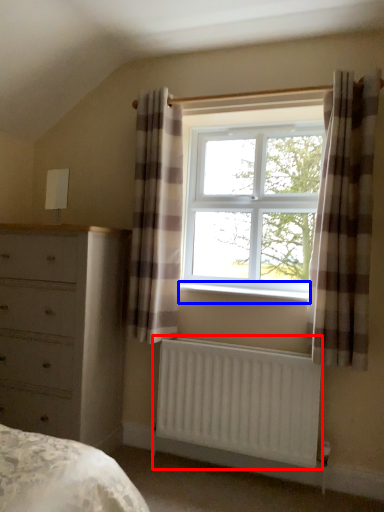
Question: Among these objects, which one is nearest to the camera, radiator (highlighted by a red box) or window sill (highlighted by a blue box)?

Choices:
 (A) radiator
 (B) window sill

Answer: (A)